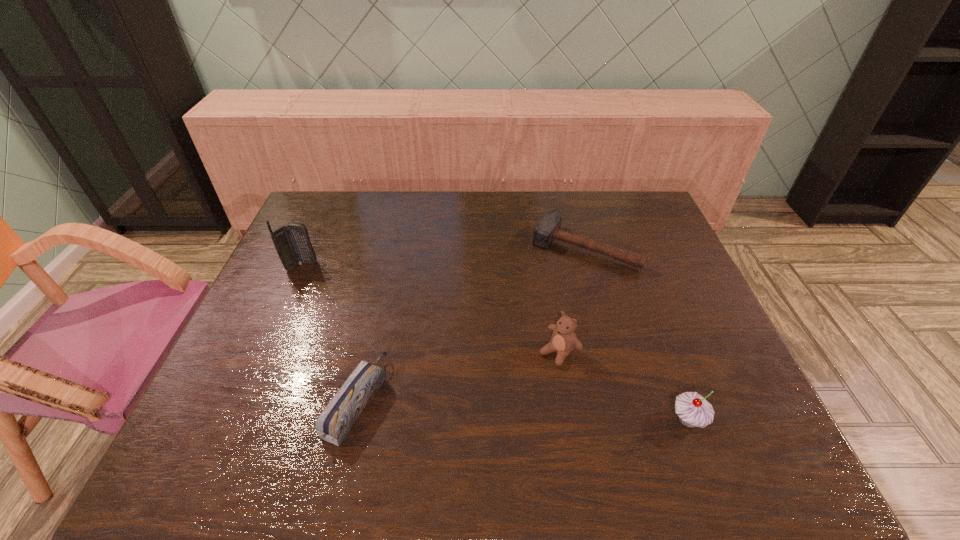
Image resolution: width=960 pixels, height=540 pixels. Identify the location of object present at the left edge. (292, 243).

Locate an element on the screen. cupcake that is positioned at the right edge is located at coordinates (693, 410).

This screenshot has height=540, width=960. In order to click on hammer at the right edge in this screenshot , I will do `click(548, 229)`.

What are the coordinates of `object that is positioned at the far right corner` in the screenshot? It's located at (548, 229).

The height and width of the screenshot is (540, 960). In order to click on object that is at the near right corner in this screenshot , I will do `click(693, 410)`.

You are a GUI agent. You are given a task and a screenshot of the screen. Output one action in this format:
    pyautogui.click(x=<x>, y=<y>)
    Task: Click on the vacant space at the far edge of the desktop
    
    Given the screenshot: What is the action you would take?
    pyautogui.click(x=540, y=205)

Where is `free space at the near edge`? The height and width of the screenshot is (540, 960). free space at the near edge is located at coordinates (609, 395).

I want to click on vacant region at the left edge, so click(x=244, y=326).

In the image, there is a desktop. Find the location of `vacant space at the right edge`. vacant space at the right edge is located at coordinates (661, 258).

Locate an element on the screen. This screenshot has width=960, height=540. vacant point at the far left corner is located at coordinates (338, 204).